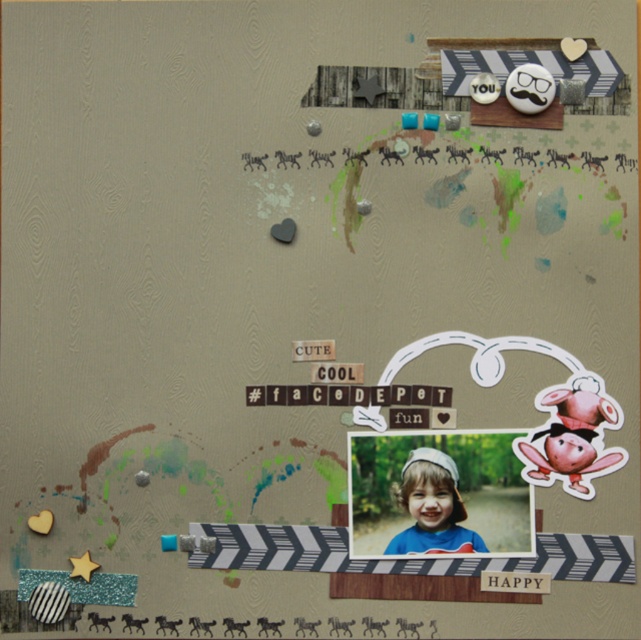
Question: Which point is closer to the camera?

Choices:
 (A) cute paper at center
 (B) matte blue shirt at center

Answer: (B)

Question: Does matte blue shirt at center appear on the left side of cute paper at center?

Choices:
 (A) no
 (B) yes

Answer: (A)

Question: Does matte blue shirt at center appear over cute paper at center?

Choices:
 (A) no
 (B) yes

Answer: (A)

Question: Which point is closer to the camera taking this photo?

Choices:
 (A) (412, 496)
 (B) (319, 342)

Answer: (A)

Question: Does matte blue shirt at center lie behind cute paper at center?

Choices:
 (A) yes
 (B) no

Answer: (B)